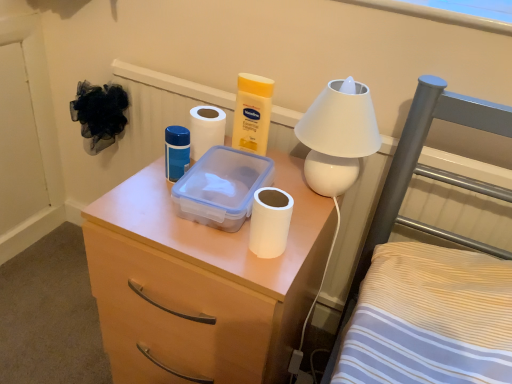
This screenshot has height=384, width=512. Find the location of `free point to the left of transparent plastic storage box at center`. free point to the left of transparent plastic storage box at center is located at coordinates (138, 200).